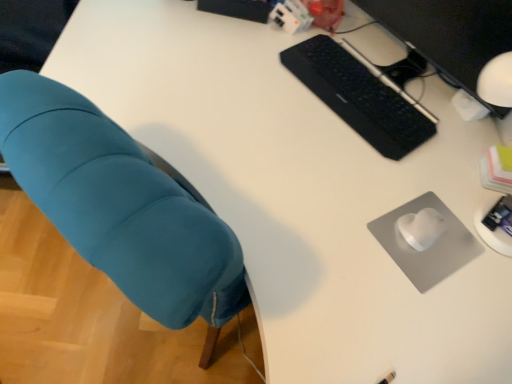
You are a GUI agent. You are given a task and a screenshot of the screen. Output one action in this format:
    pyautogui.click(x=<x>, y=<y>)
    Task: Click on the vacant space in front of gray matte mousepad at lower right
    The width and height of the screenshot is (512, 384).
    Given the screenshot: What is the action you would take?
    pyautogui.click(x=422, y=323)